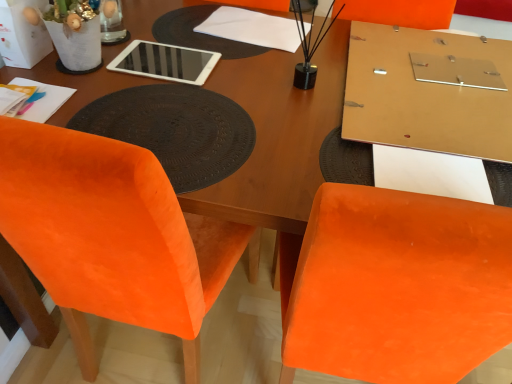
Find the location of a particular element. The width and height of the screenshot is (512, 384). free space that is in between white glossy tablet at upper center and brown textured placemat at center is located at coordinates (188, 84).